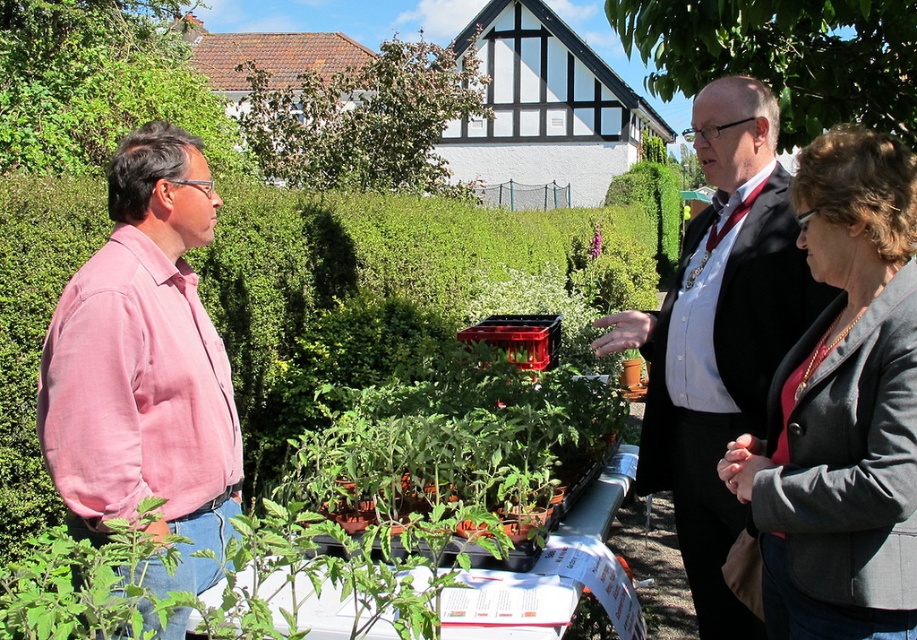
Question: Is the position of pink cotton shirt at left more distant than that of black suit at center?

Choices:
 (A) no
 (B) yes

Answer: (A)

Question: Which point is closer to the camera taking this photo?

Choices:
 (A) (728, 163)
 (B) (804, 620)
 (C) (137, 202)

Answer: (B)

Question: Does gray wool blazer at center have a greater width compared to black suit at center?

Choices:
 (A) no
 (B) yes

Answer: (A)

Question: Can you confirm if gray wool blazer at center is positioned below pink cotton shirt at left?

Choices:
 (A) no
 (B) yes

Answer: (B)

Question: Which point appears farthest from the camera in this image?

Choices:
 (A) (109, 324)
 (B) (772, 406)
 (C) (726, 134)

Answer: (C)

Question: Which of these objects is positioned closest to the gray wool blazer at center?

Choices:
 (A) black suit at center
 (B) pink cotton shirt at left

Answer: (A)